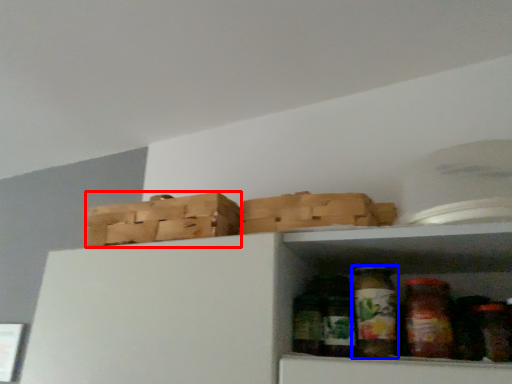
Question: Which object appears farthest to the camera in this image, basket (highlighted by a red box) or glass jar (highlighted by a blue box)?

Choices:
 (A) basket
 (B) glass jar

Answer: (A)